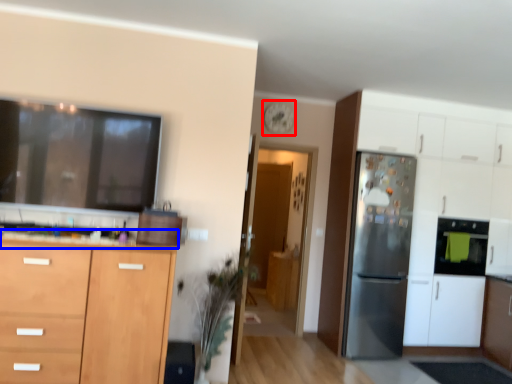
Question: Among these objects, which one is nearest to the camera, clock (highlighted by a red box) or countertop (highlighted by a blue box)?

Choices:
 (A) clock
 (B) countertop

Answer: (B)